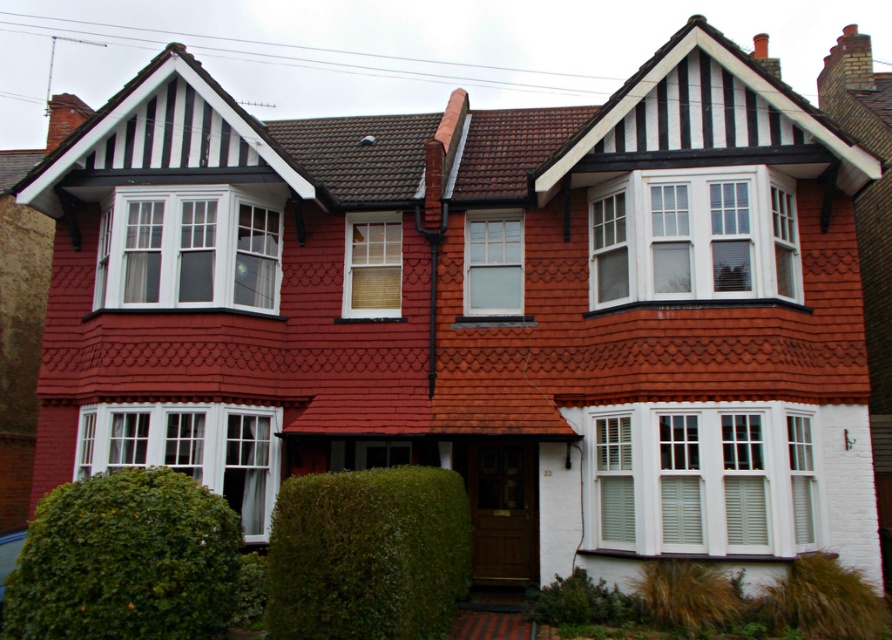
Which is behind, point (383, 256) or point (661, 428)?

The point (383, 256) is more distant.

Does wooden blinds at center have a larger size compared to white wood shutter at right?

Yes, wooden blinds at center is bigger than white wood shutter at right.

Which is behind, point (361, 268) or point (687, 467)?

The point (361, 268) is behind.

This screenshot has width=892, height=640. Identify the location of wooden blinds at center. (372, 264).

Can you confirm if white wood window at upper left is positioned to the left of white painted wood at center?

Correct, you'll find white wood window at upper left to the left of white painted wood at center.

Between white wood window at upper left and white painted wood at center, which one appears on the right side from the viewer's perspective?

white painted wood at center is more to the right.

The height and width of the screenshot is (640, 892). In order to click on white wood window at upper left in this screenshot , I will do `click(187, 250)`.

Does point (731, 525) come in front of point (613, 204)?

That is True.

Who is positioned more to the left, white wooden shutter at lower right or white wooden shutter at upper center?

From the viewer's perspective, white wooden shutter at upper center appears more on the left side.

Who is more forward, (724,467) or (601,291)?

Point (724,467) is more forward.

Locate an element on the screen. The height and width of the screenshot is (640, 892). white wooden shutter at lower right is located at coordinates (745, 509).